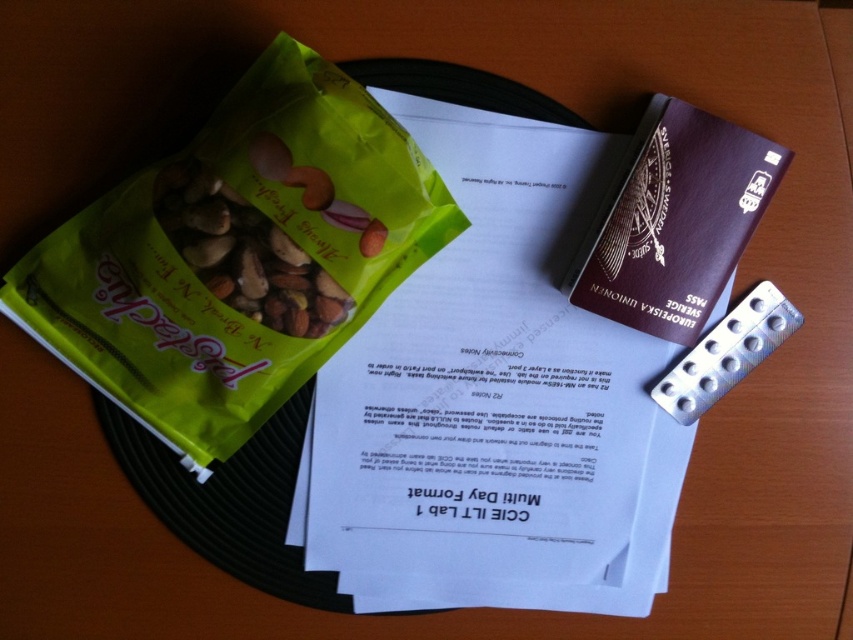
Question: Among these objects, which one is nearest to the camera?

Choices:
 (A) green matte snack packet at left
 (B) brown leather passport at upper right
 (C) green matte snack mix at center

Answer: (A)

Question: Which of the following is the closest to the observer?

Choices:
 (A) green matte snack mix at center
 (B) brown leather passport at upper right

Answer: (A)

Question: Is brown leather passport at upper right closer to the viewer compared to green matte snack mix at center?

Choices:
 (A) yes
 (B) no

Answer: (B)

Question: Is brown leather passport at upper right in front of green matte snack mix at center?

Choices:
 (A) no
 (B) yes

Answer: (A)

Question: Is green matte snack packet at left thinner than green matte snack mix at center?

Choices:
 (A) no
 (B) yes

Answer: (A)

Question: Based on their relative distances, which object is farther from the green matte snack mix at center?

Choices:
 (A) green matte snack packet at left
 (B) brown leather passport at upper right

Answer: (B)